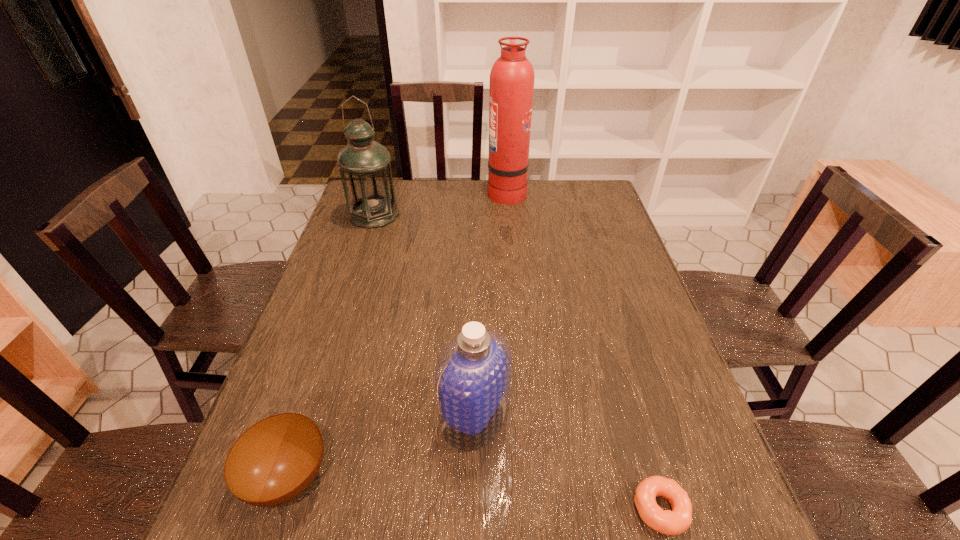
Image resolution: width=960 pixels, height=540 pixels. In order to click on fire extinguisher in this screenshot , I will do `click(512, 76)`.

This screenshot has width=960, height=540. I want to click on the fourth shortest object, so click(364, 165).

Locate an element on the screen. The image size is (960, 540). cleansing agent is located at coordinates (472, 383).

What are the coordinates of `bowl` in the screenshot? It's located at coord(275,460).

Identify the location of the shortest object. (677, 521).

Where is `doughnut`? The width and height of the screenshot is (960, 540). doughnut is located at coordinates (677, 521).

In order to click on vacant space situated on the label side of the fire extinguisher in this screenshot , I will do `click(422, 192)`.

The height and width of the screenshot is (540, 960). What are the coordinates of `blank area located 0.250m on the label side of the fire extinguisher` in the screenshot? It's located at (420, 192).

At what (x,y) coordinates should I click in order to perform the action: click on vacant space located 0.220m on the label side of the fire extinguisher. Please return your answer as a coordinate pair (x, y). The width and height of the screenshot is (960, 540). Looking at the image, I should click on (428, 192).

You are a GUI agent. You are given a task and a screenshot of the screen. Output one action in this format:
    pyautogui.click(x=<x>, y=<y>)
    Task: Click on the vacant space located on the right of the second tallest object
    This screenshot has width=960, height=540.
    Given the screenshot: What is the action you would take?
    pyautogui.click(x=425, y=215)